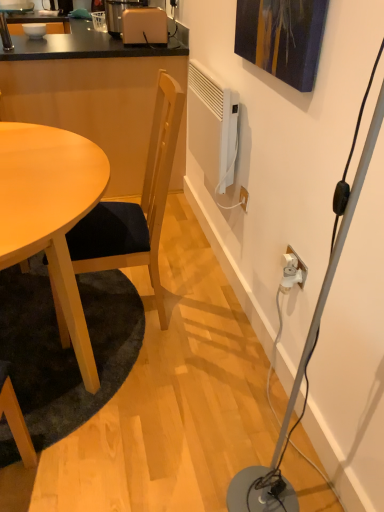
Question: In terms of size, does wooden chair at center appear bigger or smaller than white plastic plug at lower right, marked as the 1th plug in a back-to-front arrangement?

Choices:
 (A) big
 (B) small

Answer: (A)

Question: From a real-world perspective, is wooden chair at center positioned above or below white plastic plug at lower right, marked as the 1th plug in a back-to-front arrangement?

Choices:
 (A) below
 (B) above

Answer: (B)

Question: Considering the real-world distances, which object is closest to the matte beige toaster at upper center?

Choices:
 (A) white plastic power outlet at lower right, acting as the 2th power outlet starting from the top
 (B) white plastic power outlet at lower right, the 1th power outlet from the top
 (C) white plastic lamp at lower right
 (D) white plastic plug at lower right, the 2th plug viewed from the front
 (E) light brown wooden table at lower left

Answer: (B)

Question: Estimate the real-world distances between objects in this image. Which object is closer to the beige plastic coffee machine at upper center?

Choices:
 (A) matte wood table at left
 (B) white glossy bowl at upper left
 (C) light wood table at left
 (D) white plastic lamp at lower right
 (E) white plastic power outlet at lower right, the 1th power outlet in the left-to-right sequence

Answer: (B)